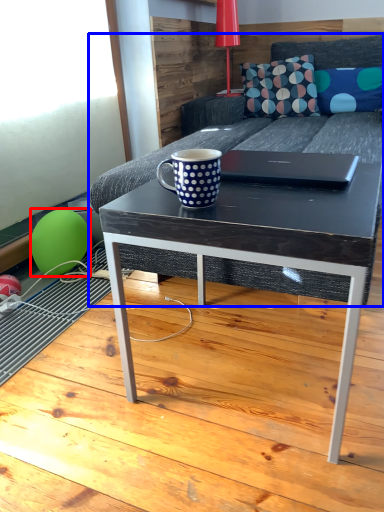
Question: Which object is closer to the camera taking this photo, balloon (highlighted by a red box) or studio couch (highlighted by a blue box)?

Choices:
 (A) balloon
 (B) studio couch

Answer: (B)